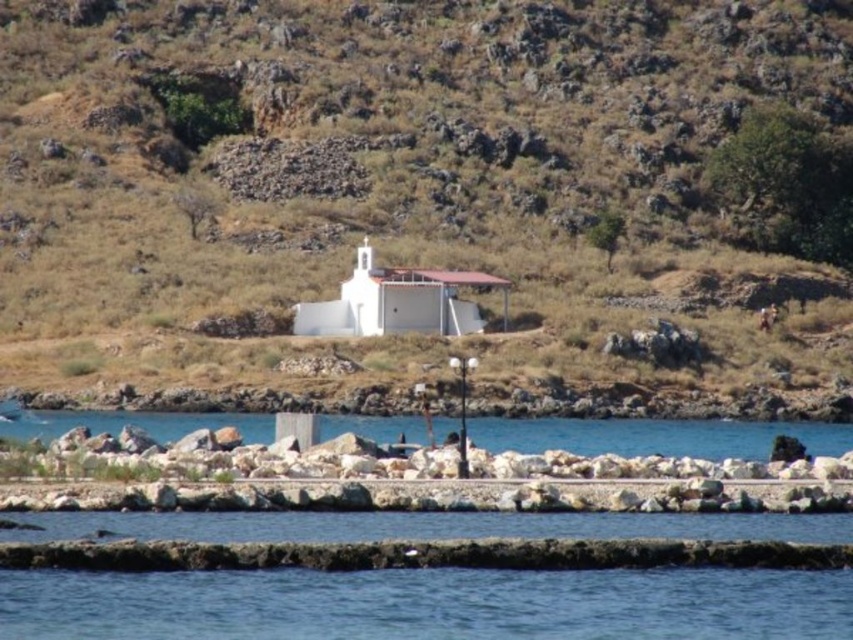
Between clear blue water at lower center and white matte church at center, which one is positioned lower?

Positioned lower is clear blue water at lower center.

Does clear blue water at lower center appear on the right side of white matte church at center?

Correct, you'll find clear blue water at lower center to the right of white matte church at center.

Find the location of `clear blue water at lower center`. clear blue water at lower center is located at coordinates (654, 436).

Between smooth rock hillside at center and white matte church at center, which one has less height?

Standing shorter between the two is white matte church at center.

Is point (459, 323) more distant than point (407, 316)?

Yes, it is behind point (407, 316).

Image resolution: width=853 pixels, height=640 pixels. I want to click on smooth rock hillside at center, so click(425, 198).

Does smooth rock hillside at center appear under clear blue water at lower center?

Incorrect, smooth rock hillside at center is not positioned below clear blue water at lower center.

Is point (521, 33) farther from camera compared to point (833, 451)?

That is True.

Locate an element on the screen. This screenshot has height=640, width=853. smooth rock hillside at center is located at coordinates (425, 198).